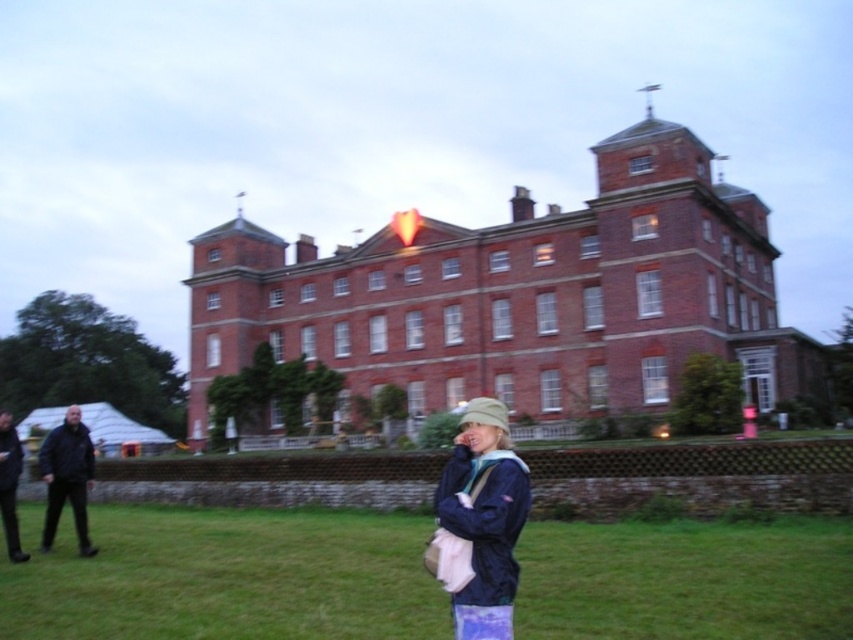
Question: Does green grass at lower center have a greater width compared to navy blue jacket at lower center?

Choices:
 (A) yes
 (B) no

Answer: (A)

Question: Which object is closer to the camera taking this photo?

Choices:
 (A) black leather jacket at lower left
 (B) navy blue jacket at lower center

Answer: (B)

Question: Considering the relative positions of black fabric jacket at left and black leather jacket at lower left in the image provided, where is black fabric jacket at left located with respect to black leather jacket at lower left?

Choices:
 (A) below
 (B) above

Answer: (A)

Question: Estimate the real-world distances between objects in this image. Which object is farther from the black fabric jacket at left?

Choices:
 (A) black leather jacket at lower left
 (B) green grass at lower center
 (C) navy blue jacket at lower center

Answer: (C)

Question: Is black fabric jacket at left to the right of black leather jacket at lower left from the viewer's perspective?

Choices:
 (A) yes
 (B) no

Answer: (A)

Question: Estimate the real-world distances between objects in this image. Which object is closer to the green grass at lower center?

Choices:
 (A) navy blue jacket at lower center
 (B) black fabric jacket at left
 (C) black leather jacket at lower left

Answer: (A)